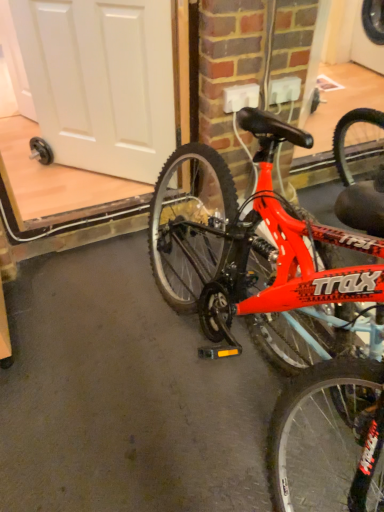
Question: Considering the relative sizes of white matte door at upper left and shiny red bicycle at center in the image provided, is white matte door at upper left bigger than shiny red bicycle at center?

Choices:
 (A) yes
 (B) no

Answer: (B)

Question: From the image's perspective, is white matte door at upper left under shiny red bicycle at center?

Choices:
 (A) yes
 (B) no

Answer: (B)

Question: Could you tell me if white matte door at upper left is facing shiny red bicycle at center?

Choices:
 (A) no
 (B) yes

Answer: (A)

Question: Considering the relative positions of white matte door at upper left and shiny red bicycle at center in the image provided, is white matte door at upper left to the left of shiny red bicycle at center from the viewer's perspective?

Choices:
 (A) no
 (B) yes

Answer: (B)

Question: Can shiny red bicycle at center be found inside white matte door at upper left?

Choices:
 (A) yes
 (B) no

Answer: (B)

Question: From a real-world perspective, is white matte door at upper left under shiny red bicycle at center?

Choices:
 (A) no
 (B) yes

Answer: (A)

Question: From the image's perspective, is shiny red bicycle at center on top of white matte door at upper left?

Choices:
 (A) yes
 (B) no

Answer: (B)

Question: Does shiny red bicycle at center turn towards white matte door at upper left?

Choices:
 (A) no
 (B) yes

Answer: (A)

Question: Is shiny red bicycle at center positioned beyond the bounds of white matte door at upper left?

Choices:
 (A) no
 (B) yes

Answer: (B)

Question: Is shiny red bicycle at center thinner than white matte door at upper left?

Choices:
 (A) no
 (B) yes

Answer: (A)

Question: Is shiny red bicycle at center bigger than white matte door at upper left?

Choices:
 (A) yes
 (B) no

Answer: (A)

Question: Is shiny red bicycle at center taller than white matte door at upper left?

Choices:
 (A) no
 (B) yes

Answer: (B)

Question: From a real-world perspective, relative to shiny red bicycle at center, is white matte door at upper left vertically above or below?

Choices:
 (A) above
 (B) below

Answer: (A)